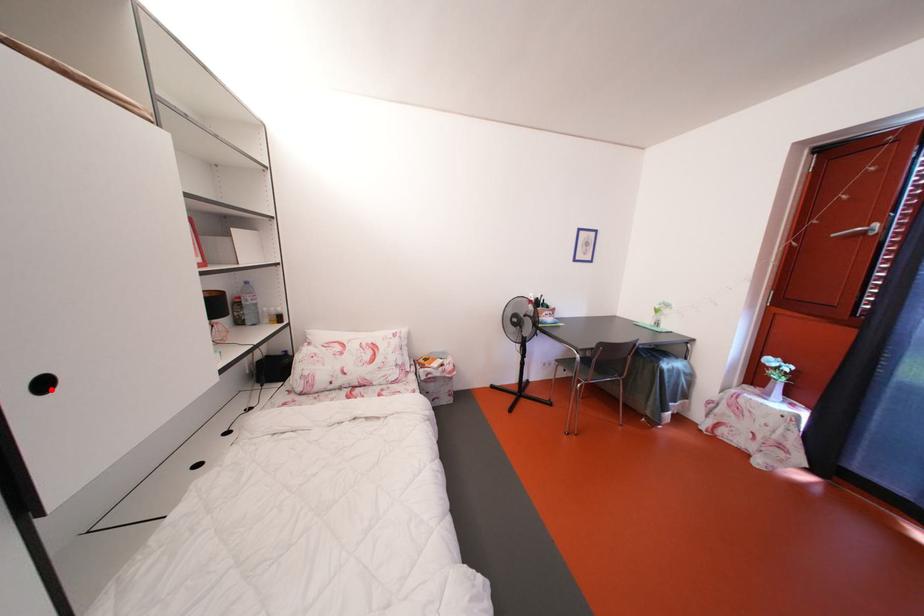
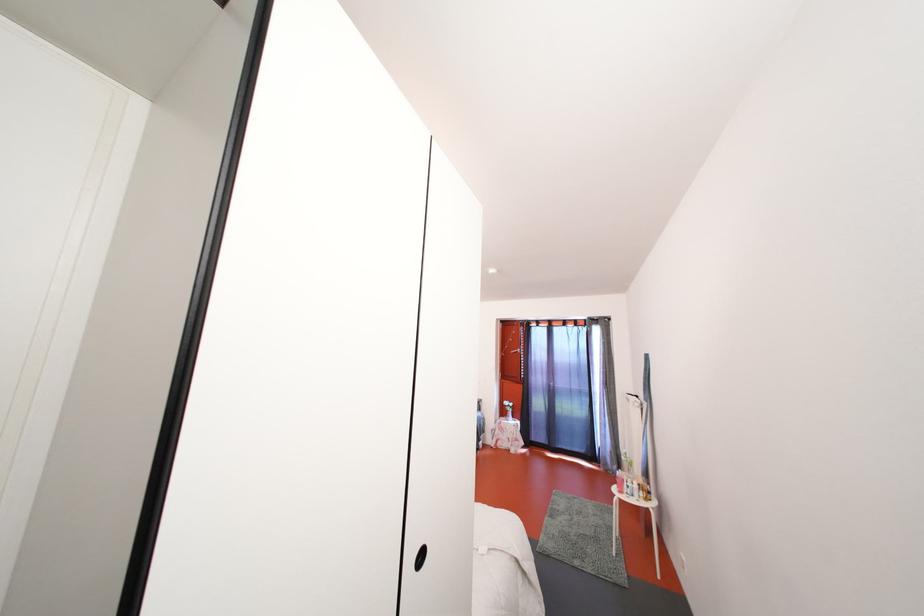
Question: I am providing you with two images of the same scene from different viewpoints. A red point is marked on the first image. Can you still see the location of the red point in image 2?

Choices:
 (A) Yes
 (B) No

Answer: (B)